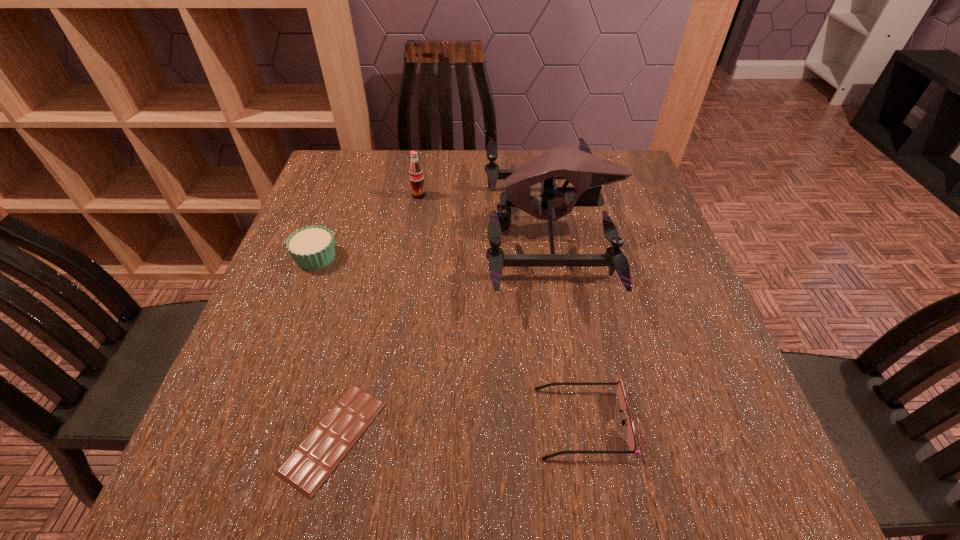
Locate an element on the screen. The height and width of the screenshot is (540, 960). free space between the drone and the second shortest object is located at coordinates (566, 326).

This screenshot has width=960, height=540. What are the coordinates of `unoccupied position between the leftmost object and the fourth shortest object` in the screenshot? It's located at (368, 226).

In order to click on vacant space that is in between the tallest object and the shortest object in this screenshot , I will do pos(443,333).

You are a GUI agent. You are given a task and a screenshot of the screen. Output one action in this format:
    pyautogui.click(x=<x>, y=<y>)
    Task: Click on the vacant area that lies between the shortest object and the soda
    
    Given the screenshot: What is the action you would take?
    pyautogui.click(x=376, y=315)

Where is `free space that is in between the tallest object and the cupcake`? Image resolution: width=960 pixels, height=540 pixels. free space that is in between the tallest object and the cupcake is located at coordinates (433, 243).

You are a GUI agent. You are given a task and a screenshot of the screen. Output one action in this format:
    pyautogui.click(x=<x>, y=<y>)
    Task: Click on the free point between the second shortest object and the third tallest object
    The width and height of the screenshot is (960, 540).
    Given the screenshot: What is the action you would take?
    pyautogui.click(x=449, y=340)

You are a GUI agent. You are given a task and a screenshot of the screen. Output one action in this format:
    pyautogui.click(x=<x>, y=<y>)
    Task: Click on the vacant point located between the fourth shortest object and the chocolate bar
    
    Given the screenshot: What is the action you would take?
    pyautogui.click(x=376, y=315)

Where is `free space between the soda and the drone`? free space between the soda and the drone is located at coordinates (485, 212).

The width and height of the screenshot is (960, 540). I want to click on empty space between the fourth tallest object and the soda, so click(x=501, y=309).

The height and width of the screenshot is (540, 960). I want to click on object that can be found as the fourth closest to the drone, so click(312, 247).